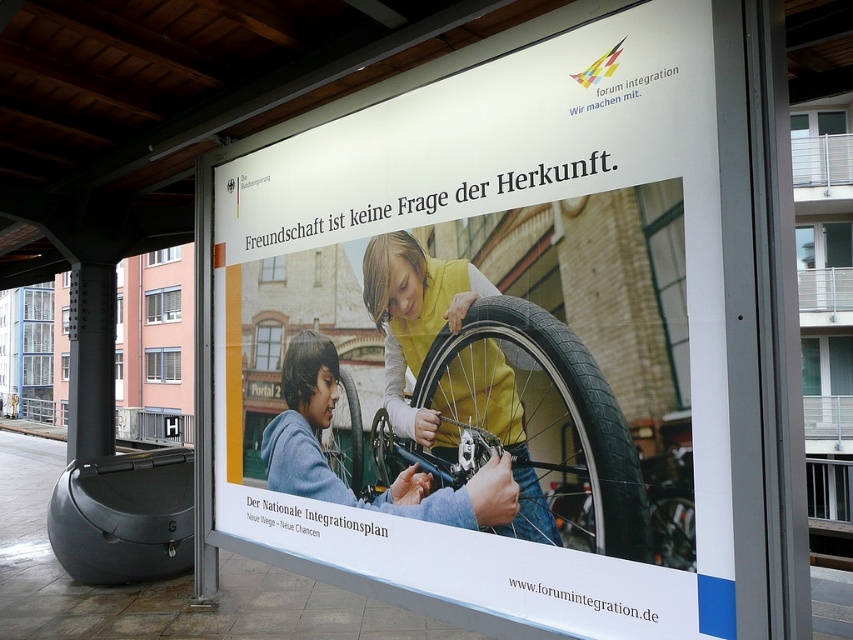
Who is shorter, white paper poster at center or yellow matte jacket at center?

yellow matte jacket at center is shorter.

Can you confirm if white paper poster at center is positioned to the right of yellow matte jacket at center?

In fact, white paper poster at center is to the left of yellow matte jacket at center.

Does point (360, 365) come farther from viewer compared to point (405, 413)?

That is True.

Where is `white paper poster at center`? Image resolution: width=853 pixels, height=640 pixels. white paper poster at center is located at coordinates (492, 332).

Can you confirm if blue fleece jacket at center is taller than rubber/textured tire at center?

Yes.

Does blue fleece jacket at center have a smaller size compared to rubber/textured tire at center?

Incorrect, blue fleece jacket at center is not smaller in size than rubber/textured tire at center.

What do you see at coordinates (312, 412) in the screenshot?
I see `blue fleece jacket at center` at bounding box center [312, 412].

This screenshot has width=853, height=640. What are the coordinates of `blue fleece jacket at center` in the screenshot? It's located at (312, 412).

Does blue fleece jacket at center have a lesser height compared to metallic silver wheel at center?

No.

Based on the photo, who is positioned more to the right, blue fleece jacket at center or metallic silver wheel at center?

From the viewer's perspective, metallic silver wheel at center appears more on the right side.

The image size is (853, 640). Find the location of `blue fleece jacket at center`. blue fleece jacket at center is located at coordinates pyautogui.click(x=312, y=412).